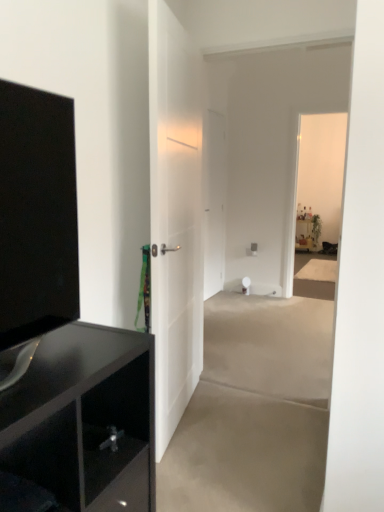
Locate an element on the screen. Image resolution: width=384 pixels, height=512 pixels. vacant point above gray matte concrete at center, marked as the 1th concrete in a bottom-to-top arrangement (from a real-world perspective) is located at coordinates (262, 465).